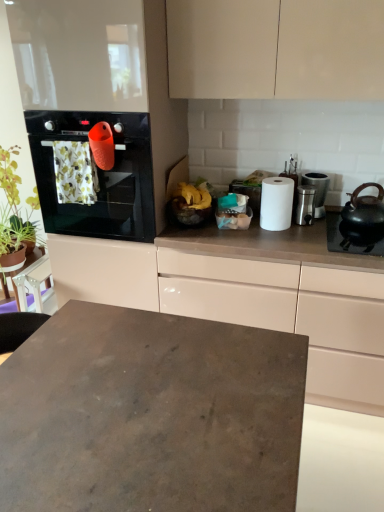
At what (x,y) coordinates should I click in order to perform the action: click on satin silver canister at center right, which ranks as the 2th appliance in right-to-left order. Please return your answer as a coordinate pair (x, y). Looking at the image, I should click on (304, 205).

The image size is (384, 512). What are the coordinates of `green leafy plant at left` in the screenshot? It's located at (15, 207).

The height and width of the screenshot is (512, 384). Describe the element at coordinates (317, 190) in the screenshot. I see `satin silver canister at right, which is the 1th appliance from right to left` at that location.

The image size is (384, 512). What do you see at coordinates (244, 302) in the screenshot?
I see `white glossy cabinet at upper right` at bounding box center [244, 302].

This screenshot has height=512, width=384. I want to click on black glass oven at left, so click(93, 175).

Find the location of a particular element. The image size is (384, 512). satin silver canister at center right, marked as the first appliance in a left-to-right arrangement is located at coordinates (304, 205).

Between matte concrete desk at center and black matte teapot at right, which one has smaller width?

black matte teapot at right is thinner.

Is matte concrete desk at center at the right side of black matte teapot at right?

In fact, matte concrete desk at center is to the left of black matte teapot at right.

Is matte concrete desk at center not inside black matte teapot at right?

Yes, matte concrete desk at center is located beyond the bounds of black matte teapot at right.

Does matte concrete desk at center have a larger size compared to black matte teapot at right?

Yes, matte concrete desk at center is bigger than black matte teapot at right.

From the image's perspective, is white glossy cabinet at upper right on satin silver canister at right, which is the 1th appliance from right to left?

No, from the image's perspective, white glossy cabinet at upper right is not over satin silver canister at right, which is the 1th appliance from right to left.

Does point (65, 277) come behind point (324, 192)?

Yes, it is behind point (324, 192).

Is white glossy cabinet at upper right beside satin silver canister at right, the 2th appliance when ordered from left to right?

white glossy cabinet at upper right and satin silver canister at right, the 2th appliance when ordered from left to right, are clearly separated.

Consider the image. Is white glossy cabinet at upper right positioned before satin silver canister at right, the 2th appliance when ordered from left to right?

Yes, white glossy cabinet at upper right is closer to the camera.

Would you say black matte teapot at right is a long distance from yellow matte bananas at center?

No, black matte teapot at right is not far from yellow matte bananas at center.

Would you say black matte teapot at right is outside yellow matte bananas at center?

Indeed, black matte teapot at right is completely outside yellow matte bananas at center.

Does black matte teapot at right have a greater height compared to yellow matte bananas at center?

Indeed, black matte teapot at right has a greater height compared to yellow matte bananas at center.

Which is farther from the camera, (367, 242) or (185, 183)?

The point (185, 183) is behind.

Considering the points (5, 238) and (364, 236), which point is behind, point (5, 238) or point (364, 236)?

The point (5, 238) is behind.

Looking at this image, is green leafy plant at left to the left or to the right of black matte teapot at right in the image?

green leafy plant at left is to the left of black matte teapot at right.

This screenshot has height=512, width=384. I want to click on plant on the left side of black matte teapot at right, so click(x=15, y=207).

Is green leafy plant at left aimed at black matte teapot at right?

No, green leafy plant at left is not facing towards black matte teapot at right.

From their relative heights in the image, would you say satin silver canister at center right, marked as the first appliance in a left-to-right arrangement, is taller or shorter than matte concrete desk at center?

Clearly, satin silver canister at center right, marked as the first appliance in a left-to-right arrangement, is shorter compared to matte concrete desk at center.

Which is farther, (x=303, y=205) or (x=2, y=364)?

The point (x=303, y=205) is more distant.

Looking at this image, is satin silver canister at center right, which ranks as the 2th appliance in right-to-left order, bigger or smaller than matte concrete desk at center?

satin silver canister at center right, which ranks as the 2th appliance in right-to-left order, is smaller than matte concrete desk at center.

Locate an element on the screen. This screenshot has width=384, height=512. desk located in front of the satin silver canister at center right, which ranks as the 2th appliance in right-to-left order is located at coordinates (150, 414).

Is black glass oven at left at the right side of yellow matte bananas at center?

No.

From their relative heights in the image, would you say black glass oven at left is taller or shorter than yellow matte bananas at center?

Clearly, black glass oven at left is taller compared to yellow matte bananas at center.

Is black glass oven at left facing towards yellow matte bananas at center?

No, black glass oven at left is not aimed at yellow matte bananas at center.

Which is behind, point (138, 215) or point (317, 197)?

Point (317, 197)

Which is in front, black glass oven at left or satin silver canister at right, the 2th appliance when ordered from left to right?

Positioned in front is black glass oven at left.

You are a GUI agent. You are given a task and a screenshot of the screen. Output one action in this format:
    pyautogui.click(x=<x>, y=<y>)
    Task: Click on the 2nd appliance to the right of the black glass oven at left, counting from the anchor's position
    The width and height of the screenshot is (384, 512).
    Given the screenshot: What is the action you would take?
    pyautogui.click(x=317, y=190)

Is black glass oven at left facing towards satin silver canister at right, the 2th appliance when ordered from left to right?

No, black glass oven at left is not facing towards satin silver canister at right, the 2th appliance when ordered from left to right.

In the image, there is a matte concrete desk at center. Identify the location of kitchen appliance above it (from the image's perspective). (363, 217).

Find the location of `cabinetry below the satin silver canister at right, the 2th appliance when ordered from left to right (from a real-world perspective)`. cabinetry below the satin silver canister at right, the 2th appliance when ordered from left to right (from a real-world perspective) is located at coordinates (244, 302).

Looking at the image, which one is located further to matte concrete desk at center, black glass oven at left or white glossy cabinet at upper right?

Based on the image, black glass oven at left appears to be further to matte concrete desk at center.

From the image, which object appears to be farther from matte concrete desk at center, white glossy cabinet at upper right or black matte gas stove at right?

black matte gas stove at right lies further to matte concrete desk at center than the other object.

When comparing their distances from black glass oven at left, does satin silver canister at right, the 2th appliance when ordered from left to right, or matte concrete desk at center seem further?

Among the two, satin silver canister at right, the 2th appliance when ordered from left to right, is located further to black glass oven at left.

Looking at the image, which one is located further to satin silver canister at center right, which ranks as the 2th appliance in right-to-left order, satin silver canister at right, the 2th appliance when ordered from left to right, or green leafy plant at left?

The object further to satin silver canister at center right, which ranks as the 2th appliance in right-to-left order, is green leafy plant at left.

Considering their positions, is yellow matte bananas at center positioned further to white matte paper towel at center than green leafy plant at left?

Based on the image, green leafy plant at left appears to be further to white matte paper towel at center.

From the image, which object appears to be farther from black matte teapot at right, black glass oven at left or satin silver canister at right, which is the 1th appliance from right to left?

The object further to black matte teapot at right is black glass oven at left.

Estimate the real-world distances between objects in this image. Which object is closer to satin silver canister at center right, marked as the first appliance in a left-to-right arrangement, white matte paper towel at center or matte concrete desk at center?

Among the two, white matte paper towel at center is located nearer to satin silver canister at center right, marked as the first appliance in a left-to-right arrangement.

From the image, which object appears to be nearer to green leafy plant at left, white matte paper towel at center or black glass oven at left?

black glass oven at left.

This screenshot has width=384, height=512. In order to click on cabinetry between matte concrete desk at center and green leafy plant at left in the front-back direction in this screenshot , I will do `click(244, 302)`.

Image resolution: width=384 pixels, height=512 pixels. I want to click on gas stove located between satin silver canister at center right, which ranks as the 2th appliance in right-to-left order, and black matte teapot at right in the left-right direction, so click(353, 236).

The height and width of the screenshot is (512, 384). In order to click on gas stove that lies between satin silver canister at right, which is the 1th appliance from right to left, and white glossy cabinet at upper right from top to bottom in this screenshot , I will do pos(353,236).

Where is `food between black glass oven at left and satin silver canister at center right, which ranks as the 2th appliance in right-to-left order, from left to right`? The width and height of the screenshot is (384, 512). food between black glass oven at left and satin silver canister at center right, which ranks as the 2th appliance in right-to-left order, from left to right is located at coordinates (192, 196).